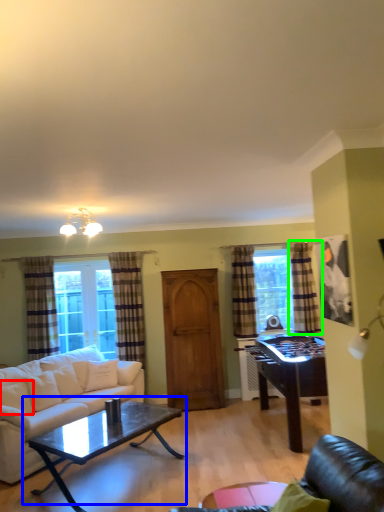
Question: Estimate the real-world distances between objects in this image. Which object is closer to pillow (highlighted by a red box), coffee table (highlighted by a blue box) or curtain (highlighted by a green box)?

Choices:
 (A) coffee table
 (B) curtain

Answer: (A)